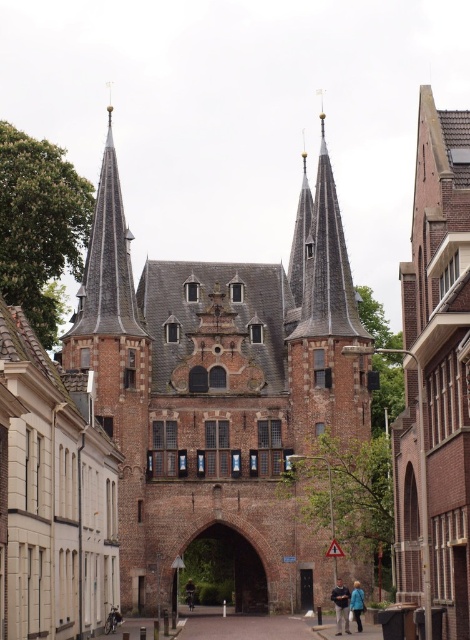
You are standing in front of the historic brick structure and notice both the smooth gray spire at center and the light brown leather jacket at center. Which object is positioned higher relative to the other?

The smooth gray spire at center is above the light brown leather jacket at center, so it is positioned higher.

You are a tourist visiting this historic gatehouse and notice both the smooth gray spire at center and the light brown leather jacket at center. Which object is taller?

The smooth gray spire at center is taller than the light brown leather jacket at center.